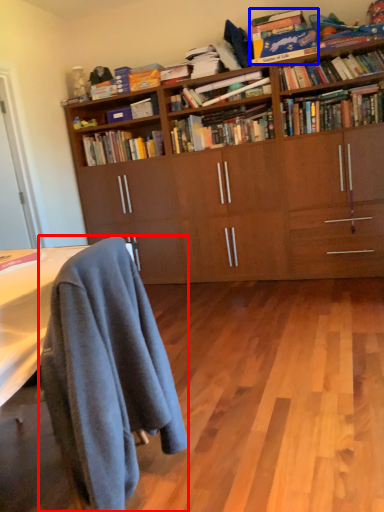
Question: Which object is further to the camera taking this photo, chair (highlighted by a red box) or book (highlighted by a blue box)?

Choices:
 (A) chair
 (B) book

Answer: (B)